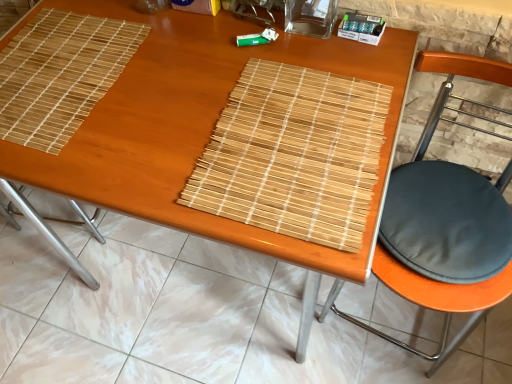
Locate an element on the screen. This screenshot has height=384, width=512. vacant area that lies between natural wood mat at upper left, positioned as the second mat in right-to-left order, and natural bamboo mat at center, positioned as the second mat in left-to-right order is located at coordinates (162, 106).